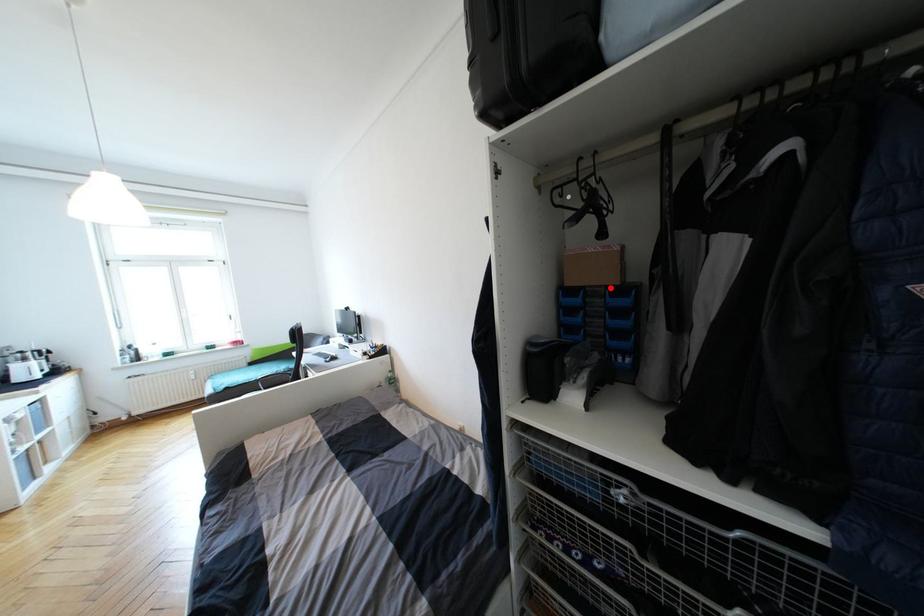
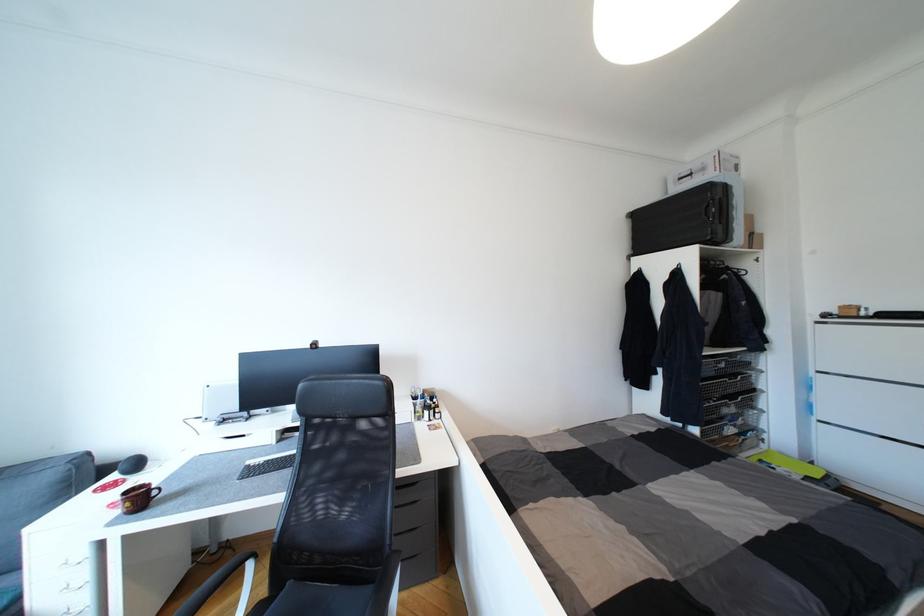
Question: I am providing you with two images of the same scene from different viewpoints. A red point is marked on the first image. Is the red point's position out of view in image 2?

Choices:
 (A) Yes
 (B) No

Answer: (A)